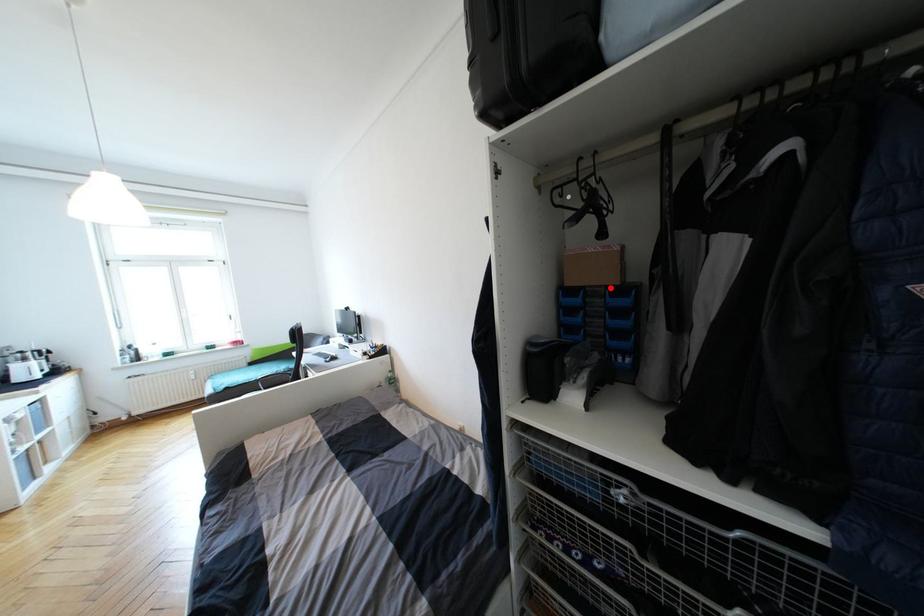
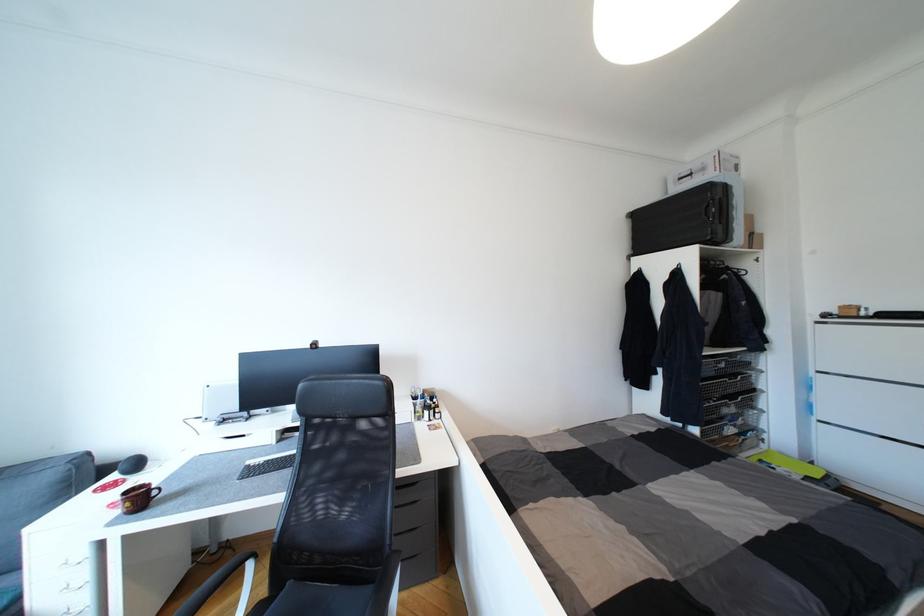
Question: I am providing you with two images of the same scene from different viewpoints. A red point is marked on the first image. Is the red point's position out of view in image 2?

Choices:
 (A) Yes
 (B) No

Answer: (A)